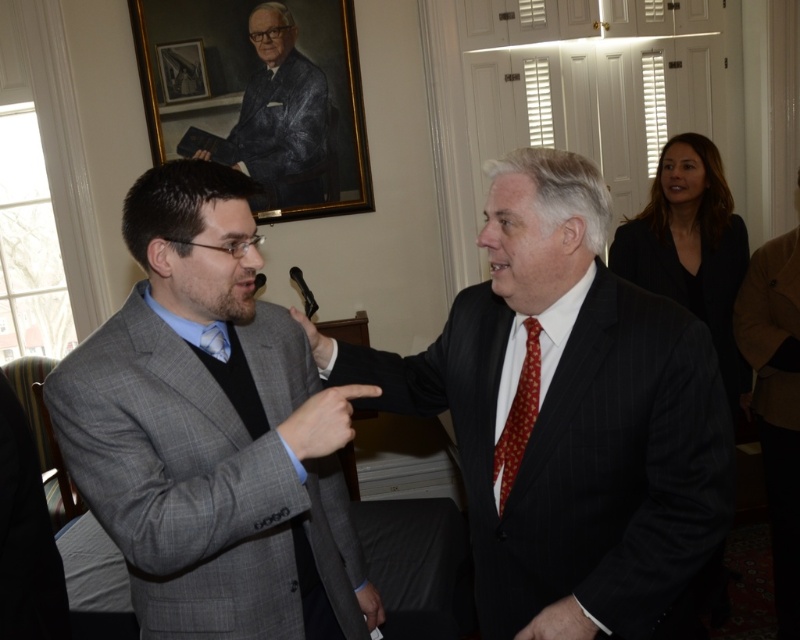
You are standing in the room and want to determine which of the two points, point (590, 476) or point (513, 406), is closer to you. Based on the scene description, which point is nearer?

Point (590, 476) is closer to the viewer than point (513, 406).

You are a tailor measuring garments for alterations. You need to determine which item is wider between the gray wool suit at center and the red silk tie at center. Based on the image, which one is wider?

The gray wool suit at center is wider than the red silk tie at center according to the description.